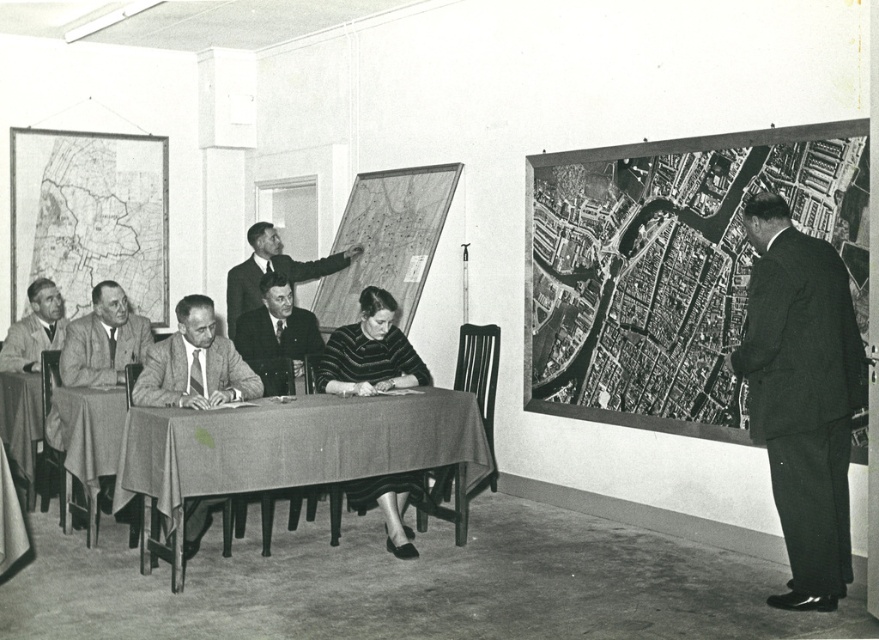
Who is taller, striped sweater at center or gray wool suit at table left?

Standing taller between the two is striped sweater at center.

Is point (369, 376) closer to viewer compared to point (175, 385)?

No, (369, 376) is further to viewer.

Who is more forward, (x=396, y=525) or (x=175, y=401)?

Point (x=175, y=401)

Identify the location of striped sweater at center. 369,353.

Does textured fabric table at center have a greater height compared to light gray suit at table left?

Yes, textured fabric table at center is taller than light gray suit at table left.

From the picture: Between textured fabric table at center and light gray suit at table left, which one is positioned lower?

Positioned lower is textured fabric table at center.

Who is more distant from viewer, (404,472) or (76,358)?

Positioned behind is point (76,358).

At what (x,y) coordinates should I click in order to perform the action: click on textured fabric table at center. Please return your answer as a coordinate pair (x, y). The width and height of the screenshot is (879, 640). Looking at the image, I should click on (300, 449).

Between smooth gray suit at left and smooth black suit at center, which one is positioned lower?

smooth black suit at center

Is point (95, 301) behind point (265, 301)?

No, it is in front of (265, 301).

The height and width of the screenshot is (640, 879). Find the location of `smooth gray suit at left`. smooth gray suit at left is located at coordinates (103, 340).